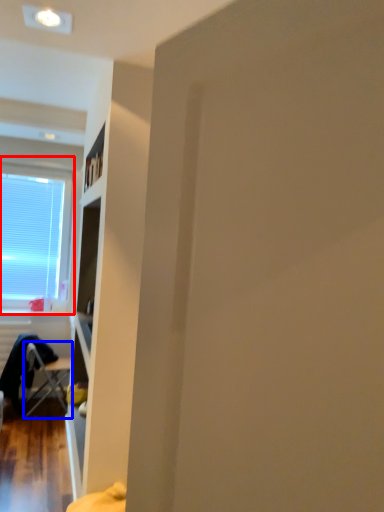
Question: Which of the following is the farthest to the observer, window (highlighted by a red box) or chair (highlighted by a blue box)?

Choices:
 (A) window
 (B) chair

Answer: (A)